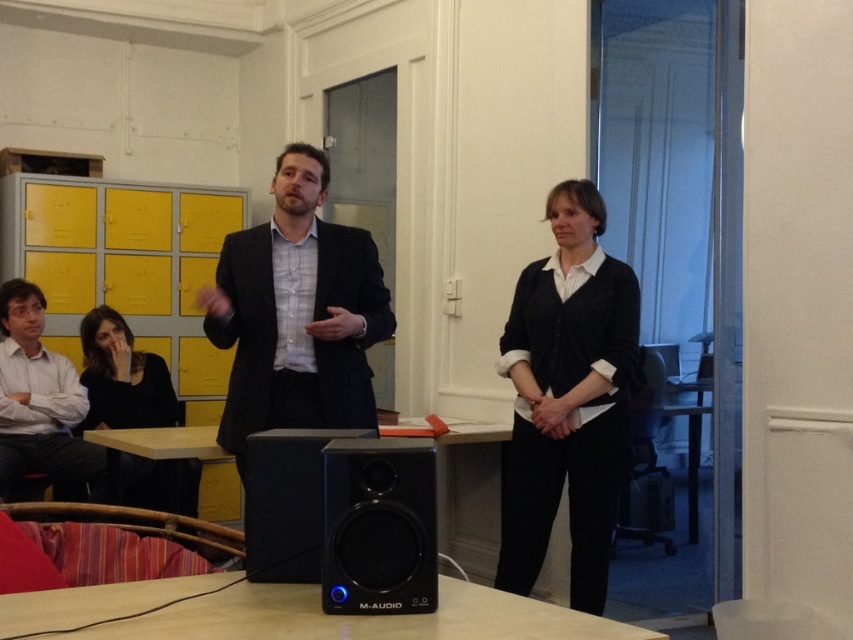
Question: Is black matte business suit at center smaller than light brown wooden table at lower center?

Choices:
 (A) yes
 (B) no

Answer: (B)

Question: Which point is farther from the camera taking this photo?

Choices:
 (A) (358, 632)
 (B) (96, 392)

Answer: (B)

Question: Estimate the real-world distances between objects in this image. Which object is farther from the black matte speaker at lower center?

Choices:
 (A) wooden table at center
 (B) black textured suit at center
 (C) matte white shirt at lower left

Answer: (C)

Question: Which of the following is the closest to the observer?

Choices:
 (A) wooden table at center
 (B) black textured suit at center
 (C) black plastic speaker at lower center
 (D) black matte business suit at center

Answer: (A)

Question: Observing the image, what is the correct spatial positioning of black matte business suit at center in reference to wooden table at center?

Choices:
 (A) right
 (B) left

Answer: (A)

Question: Does black matte business suit at center have a larger size compared to matte white shirt at lower left?

Choices:
 (A) yes
 (B) no

Answer: (B)